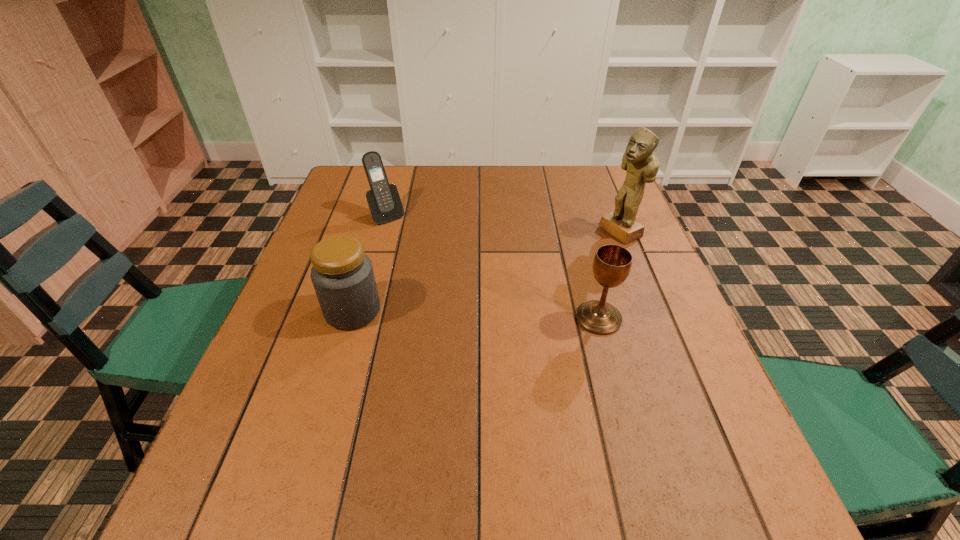
Identify the location of vacant spot on the desktop that is between the jar and the chalice and is positioned on the front-facing side of the cellular telephone. (471, 314).

I want to click on vacant space on the desktop that is between the jar and the chalice and is positioned on the front-facing side of the tallest object, so click(455, 314).